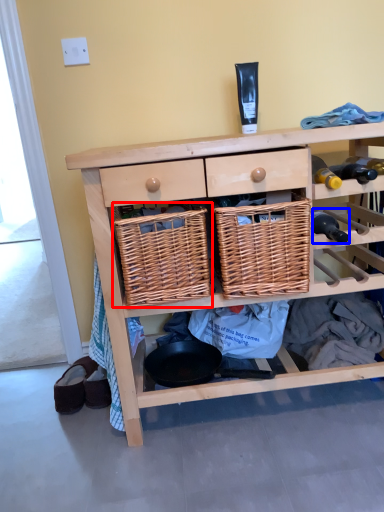
Question: Which of the following is the farthest to the observer, basket (highlighted by a red box) or bottle (highlighted by a blue box)?

Choices:
 (A) basket
 (B) bottle

Answer: (B)